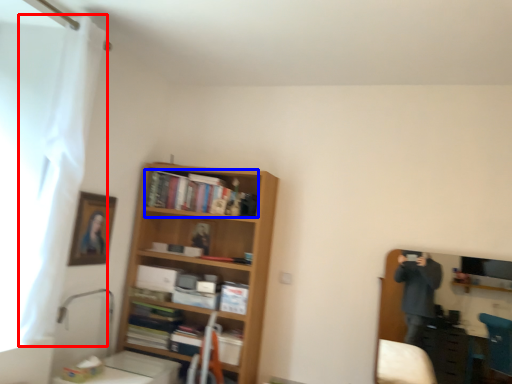
Question: Which point is closer to the camera, curtain (highlighted by a red box) or book (highlighted by a blue box)?

Choices:
 (A) curtain
 (B) book

Answer: (A)